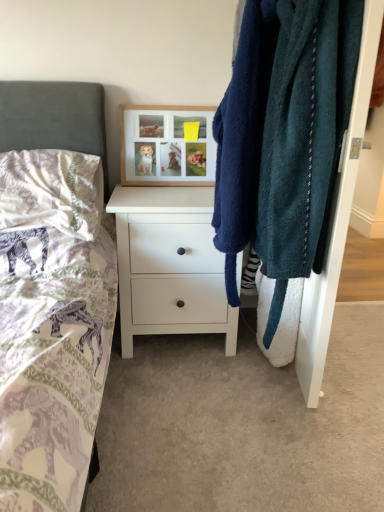
This screenshot has height=512, width=384. I want to click on free space above white matte chest of drawers at center (from a real-world perspective), so click(167, 190).